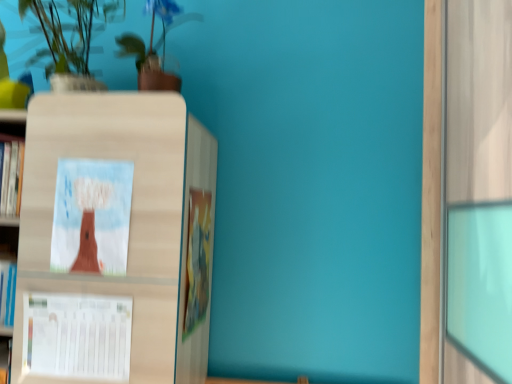
This screenshot has height=384, width=512. Describe the element at coordinates (69, 40) in the screenshot. I see `green matte plant at upper left, the 1th houseplant when ordered from left to right` at that location.

What do you see at coordinates (77, 335) in the screenshot? This screenshot has height=384, width=512. I see `white paper calendar at lower left, marked as the 1th book cover in a bottom-to-top arrangement` at bounding box center [77, 335].

Describe the element at coordinates (154, 47) in the screenshot. The height and width of the screenshot is (384, 512). I see `green matte plant at upper center, which is counted as the 1th houseplant, starting from the right` at that location.

At what (x,y) coordinates should I click in order to perform the action: click on hardcover book at center. Please return your answer as a coordinate pair (x, y). Image resolution: width=512 pixels, height=384 pixels. Looking at the image, I should click on (197, 259).

Where is `green matte plant at upper left, the 1th houseplant when ordered from left to right`? Image resolution: width=512 pixels, height=384 pixels. green matte plant at upper left, the 1th houseplant when ordered from left to right is located at coordinates (69, 40).

Is point (85, 166) farther from viewer compared to point (63, 63)?

No, (85, 166) is in front of (63, 63).

Who is smaller, matte paper tree at center, acting as the second book cover starting from the bottom, or green matte plant at upper left, the 1th houseplant when ordered from left to right?

matte paper tree at center, acting as the second book cover starting from the bottom.

From a real-world perspective, between matte paper tree at center, acting as the second book cover starting from the bottom, and green matte plant at upper left, which is counted as the second houseplant, starting from the right, who is vertically higher?

In real-world perspective, green matte plant at upper left, which is counted as the second houseplant, starting from the right, is above.

Considering the sizes of objects matte paper tree at center, acting as the second book cover starting from the bottom, and green matte plant at upper left, the 1th houseplant when ordered from left to right, in the image provided, who is wider, matte paper tree at center, acting as the second book cover starting from the bottom, or green matte plant at upper left, the 1th houseplant when ordered from left to right,?

green matte plant at upper left, the 1th houseplant when ordered from left to right.

From a real-world perspective, who is located higher, white paper calendar at lower left, marked as the 1th book cover in a bottom-to-top arrangement, or hardcover book at center?

hardcover book at center, from a real-world perspective.

Is white paper calendar at lower left, marked as the 1th book cover in a bottom-to-top arrangement, directly adjacent to hardcover book at center?

No.

Consider the image. From the image's perspective, between white paper calendar at lower left, marked as the second book cover in a top-to-bottom arrangement, and hardcover book at center, which one is located above?

hardcover book at center.

In the scene shown: What's the angular difference between white paper calendar at lower left, marked as the second book cover in a top-to-bottom arrangement, and hardcover book at center's facing directions?

white paper calendar at lower left, marked as the second book cover in a top-to-bottom arrangement, and hardcover book at center are facing 90 degrees away from each other.

In the scene shown: Is white paper calendar at lower left, marked as the second book cover in a top-to-bottom arrangement, situated inside matte paper tree at center, arranged as the first book cover when viewed from the top, or outside?

white paper calendar at lower left, marked as the second book cover in a top-to-bottom arrangement, cannot be found inside matte paper tree at center, arranged as the first book cover when viewed from the top.

From a real-world perspective, is white paper calendar at lower left, marked as the 1th book cover in a bottom-to-top arrangement, physically located above or below matte paper tree at center, acting as the second book cover starting from the bottom?

In terms of real-world spatial position, white paper calendar at lower left, marked as the 1th book cover in a bottom-to-top arrangement, is below matte paper tree at center, acting as the second book cover starting from the bottom.

Considering the sizes of objects white paper calendar at lower left, marked as the second book cover in a top-to-bottom arrangement, and matte paper tree at center, arranged as the first book cover when viewed from the top, in the image provided, who is thinner, white paper calendar at lower left, marked as the second book cover in a top-to-bottom arrangement, or matte paper tree at center, arranged as the first book cover when viewed from the top,?

Thinner between the two is matte paper tree at center, arranged as the first book cover when viewed from the top.

Considering the relative sizes of white paper calendar at lower left, marked as the second book cover in a top-to-bottom arrangement, and matte paper tree at center, arranged as the first book cover when viewed from the top, in the image provided, is white paper calendar at lower left, marked as the second book cover in a top-to-bottom arrangement, shorter than matte paper tree at center, arranged as the first book cover when viewed from the top,?

Correct, white paper calendar at lower left, marked as the second book cover in a top-to-bottom arrangement, is not as tall as matte paper tree at center, arranged as the first book cover when viewed from the top.

Which point is more distant from viewer, (200, 321) or (80, 163)?

The point (200, 321) is farther.

Looking at this image, from the image's perspective, is hardcover book at center beneath matte paper tree at center, arranged as the first book cover when viewed from the top?

Yes, from the image's perspective, hardcover book at center is beneath matte paper tree at center, arranged as the first book cover when viewed from the top.

Looking at this image, in the image, is hardcover book at center positioned in front of or behind matte paper tree at center, acting as the second book cover starting from the bottom?

hardcover book at center is behind matte paper tree at center, acting as the second book cover starting from the bottom.

From the picture: Which of these two, hardcover book at center or matte paper tree at center, arranged as the first book cover when viewed from the top, stands shorter?

Standing shorter between the two is matte paper tree at center, arranged as the first book cover when viewed from the top.

Does hardcover book at center turn towards green matte plant at upper center, arranged as the second houseplant when viewed from the left?

No, hardcover book at center is not aimed at green matte plant at upper center, arranged as the second houseplant when viewed from the left.

From the image's perspective, between hardcover book at center and green matte plant at upper center, which is counted as the 1th houseplant, starting from the right, who is located below?

hardcover book at center.

Is hardcover book at center far away from green matte plant at upper center, arranged as the second houseplant when viewed from the left?

That's not correct — hardcover book at center is a little close to green matte plant at upper center, arranged as the second houseplant when viewed from the left.

Is the position of hardcover book at center less distant than that of green matte plant at upper center, which is counted as the 1th houseplant, starting from the right?

Answer: No.

Can you confirm if green matte plant at upper left, which is counted as the second houseplant, starting from the right, is thinner than matte paper tree at center, acting as the second book cover starting from the bottom?

No.

How different are the orientations of green matte plant at upper left, the 1th houseplant when ordered from left to right, and matte paper tree at center, arranged as the first book cover when viewed from the top, in degrees?

The facing directions of green matte plant at upper left, the 1th houseplant when ordered from left to right, and matte paper tree at center, arranged as the first book cover when viewed from the top, are 0.0039 degrees apart.

From a real-world perspective, relative to matte paper tree at center, acting as the second book cover starting from the bottom, is green matte plant at upper left, which is counted as the second houseplant, starting from the right, vertically above or below?

In terms of real-world spatial position, green matte plant at upper left, which is counted as the second houseplant, starting from the right, is above matte paper tree at center, acting as the second book cover starting from the bottom.

Considering the positions of points (99, 88) and (126, 250), is point (99, 88) closer to camera compared to point (126, 250)?

No, (99, 88) is behind (126, 250).

Who is taller, green matte plant at upper left, the 1th houseplant when ordered from left to right, or white paper calendar at lower left, marked as the 1th book cover in a bottom-to-top arrangement?

With more height is green matte plant at upper left, the 1th houseplant when ordered from left to right.

How different are the orientations of green matte plant at upper left, which is counted as the second houseplant, starting from the right, and white paper calendar at lower left, marked as the 1th book cover in a bottom-to-top arrangement, in degrees?

The facing directions of green matte plant at upper left, which is counted as the second houseplant, starting from the right, and white paper calendar at lower left, marked as the 1th book cover in a bottom-to-top arrangement, are 0.00509 degrees apart.

Is green matte plant at upper left, the 1th houseplant when ordered from left to right, at the right side of white paper calendar at lower left, marked as the 1th book cover in a bottom-to-top arrangement?

Incorrect, green matte plant at upper left, the 1th houseplant when ordered from left to right, is not on the right side of white paper calendar at lower left, marked as the 1th book cover in a bottom-to-top arrangement.

Considering the points (57, 55) and (62, 362), which point is behind, point (57, 55) or point (62, 362)?

Point (57, 55)

Find the location of a particular element. the 2nd houseplant above the matte paper tree at center, acting as the second book cover starting from the bottom (from the image's perspective) is located at coordinates (69, 40).

Where is `book that appears behind the white paper calendar at lower left, marked as the 1th book cover in a bottom-to-top arrangement`? This screenshot has width=512, height=384. book that appears behind the white paper calendar at lower left, marked as the 1th book cover in a bottom-to-top arrangement is located at coordinates (197, 259).

Estimate the real-world distances between objects in this image. Which object is closer to green matte plant at upper left, the 1th houseplant when ordered from left to right, green matte plant at upper center, which is counted as the 1th houseplant, starting from the right, or hardcover book at center?

green matte plant at upper center, which is counted as the 1th houseplant, starting from the right, is closer to green matte plant at upper left, the 1th houseplant when ordered from left to right.

Which object lies further to the anchor point white paper calendar at lower left, marked as the second book cover in a top-to-bottom arrangement, hardcover book at center or green matte plant at upper center, arranged as the second houseplant when viewed from the left?

→ green matte plant at upper center, arranged as the second houseplant when viewed from the left.

From the image, which object appears to be farther from white paper calendar at lower left, marked as the 1th book cover in a bottom-to-top arrangement, hardcover book at center or matte paper tree at center, acting as the second book cover starting from the bottom?

The object further to white paper calendar at lower left, marked as the 1th book cover in a bottom-to-top arrangement, is hardcover book at center.

Estimate the real-world distances between objects in this image. Which object is further from green matte plant at upper left, which is counted as the second houseplant, starting from the right, white paper calendar at lower left, marked as the 1th book cover in a bottom-to-top arrangement, or matte paper tree at center, acting as the second book cover starting from the bottom?

Among the two, white paper calendar at lower left, marked as the 1th book cover in a bottom-to-top arrangement, is located further to green matte plant at upper left, which is counted as the second houseplant, starting from the right.

When comparing their distances from matte paper tree at center, arranged as the first book cover when viewed from the top, does green matte plant at upper center, which is counted as the 1th houseplant, starting from the right, or hardcover book at center seem closer?

The object closer to matte paper tree at center, arranged as the first book cover when viewed from the top, is hardcover book at center.

Considering their positions, is hardcover book at center positioned further to green matte plant at upper left, which is counted as the second houseplant, starting from the right, than green matte plant at upper center, which is counted as the 1th houseplant, starting from the right?

hardcover book at center lies further to green matte plant at upper left, which is counted as the second houseplant, starting from the right, than the other object.

Looking at the image, which one is located further to hardcover book at center, green matte plant at upper center, which is counted as the 1th houseplant, starting from the right, or matte paper tree at center, arranged as the first book cover when viewed from the top?

Among the two, green matte plant at upper center, which is counted as the 1th houseplant, starting from the right, is located further to hardcover book at center.

From the image, which object appears to be nearer to green matte plant at upper left, which is counted as the second houseplant, starting from the right, matte paper tree at center, acting as the second book cover starting from the bottom, or hardcover book at center?

Answer: matte paper tree at center, acting as the second book cover starting from the bottom, is closer to green matte plant at upper left, which is counted as the second houseplant, starting from the right.

The width and height of the screenshot is (512, 384). What are the coordinates of `houseplant that lies between green matte plant at upper left, which is counted as the second houseplant, starting from the right, and white paper calendar at lower left, marked as the second book cover in a top-to-bottom arrangement, from top to bottom` in the screenshot? It's located at (154, 47).

Identify the location of book cover between green matte plant at upper left, which is counted as the second houseplant, starting from the right, and hardcover book at center, in the vertical direction. The image size is (512, 384). (92, 216).

In order to click on book between green matte plant at upper center, which is counted as the 1th houseplant, starting from the right, and white paper calendar at lower left, marked as the second book cover in a top-to-bottom arrangement, from top to bottom in this screenshot , I will do `click(197, 259)`.

Locate an element on the screen. The height and width of the screenshot is (384, 512). houseplant between green matte plant at upper left, which is counted as the second houseplant, starting from the right, and hardcover book at center vertically is located at coordinates coord(154,47).